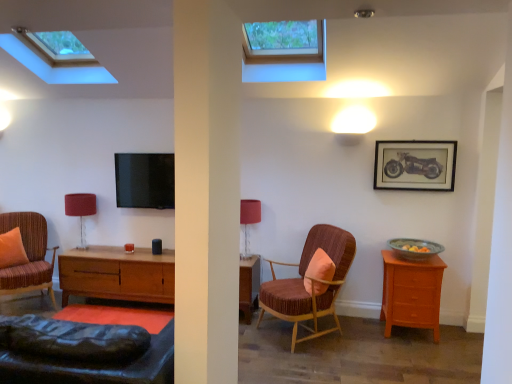
Find the location of a particular element. vacant space in front of light brown wood nightstand at right is located at coordinates [412, 358].